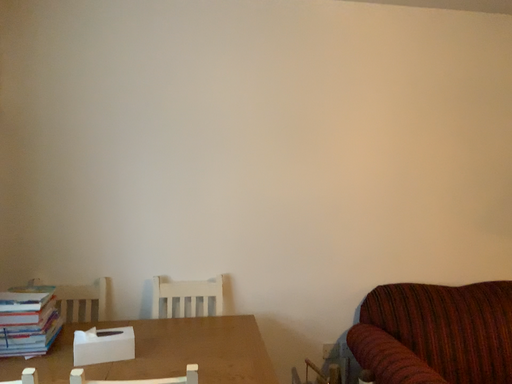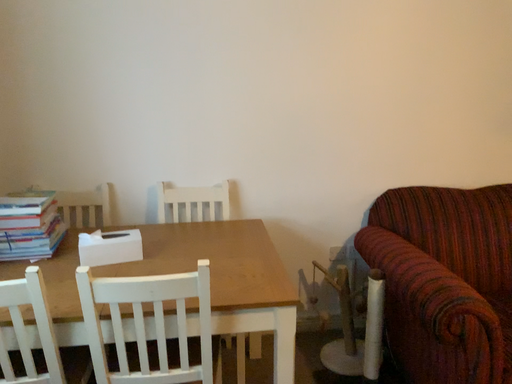
Question: Which way did the camera rotate in the video?

Choices:
 (A) rotated upward
 (B) rotated downward

Answer: (B)